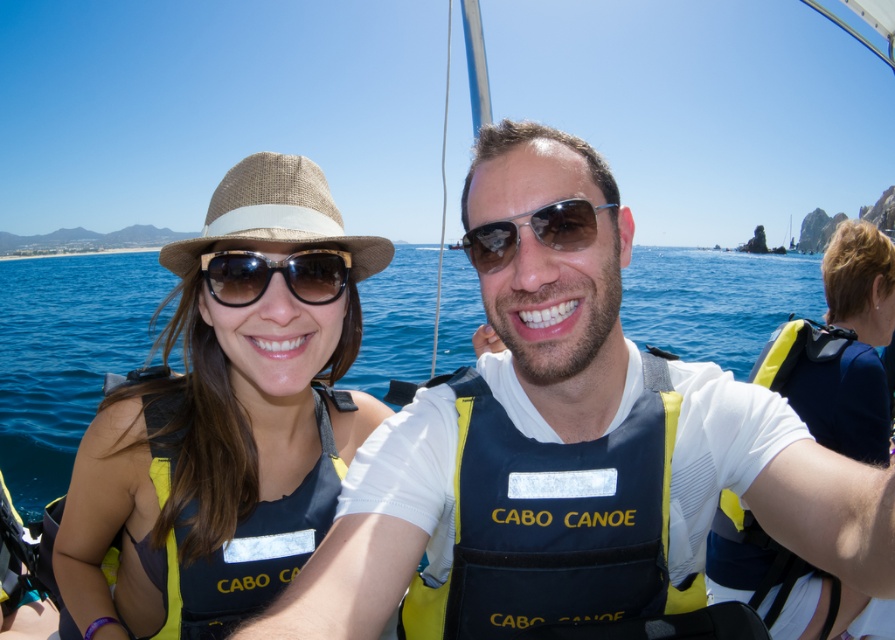
Looking at this image, is matte blue life vest at center taller than yellow and navy blue life vest at left?

Yes, matte blue life vest at center is taller than yellow and navy blue life vest at left.

Is point (337, 608) positioned before point (168, 444)?

Yes, it is.

In order to click on matte blue life vest at center in this screenshot , I will do `click(374, 529)`.

Does blue water at center appear under yellow and navy blue life vest at left?

Actually, blue water at center is above yellow and navy blue life vest at left.

Is blue water at center above yellow and navy blue life vest at left?

Indeed, blue water at center is positioned over yellow and navy blue life vest at left.

Locate an element on the screen. blue water at center is located at coordinates (64, 356).

What are the coordinates of `blue water at center` in the screenshot? It's located at (64, 356).

Is blue water at center smaller than dark blue fabric life vest at center?

Actually, blue water at center might be larger than dark blue fabric life vest at center.

You are a GUI agent. You are given a task and a screenshot of the screen. Output one action in this format:
    pyautogui.click(x=<x>, y=<y>)
    Task: Click on the blue water at center
    Image resolution: width=895 pixels, height=640 pixels.
    Given the screenshot: What is the action you would take?
    pyautogui.click(x=64, y=356)

Where is `blue water at center`? blue water at center is located at coordinates (64, 356).